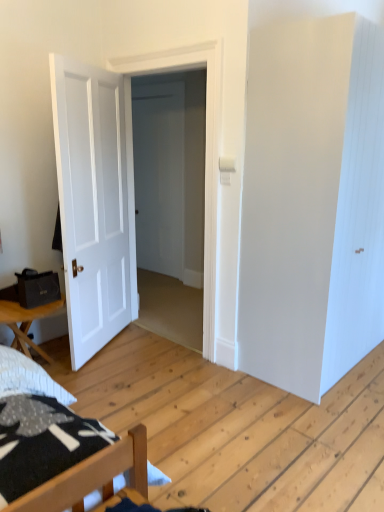
Question: From a real-world perspective, is white smooth door at center, the 2th door from the left, above or below white matte door at left, which appears as the first door when viewed from the left?

Choices:
 (A) above
 (B) below

Answer: (A)

Question: Based on their sizes in the image, would you say white smooth door at center, the first door when ordered from right to left, is bigger or smaller than white matte door at left, which appears as the first door when viewed from the left?

Choices:
 (A) small
 (B) big

Answer: (B)

Question: Estimate the real-world distances between objects in this image. Which object is closer to the wooden table at lower left?

Choices:
 (A) white matte door at left, which appears as the first door when viewed from the left
 (B) white smooth door at center, the first door when ordered from right to left

Answer: (A)

Question: Considering the real-world distances, which object is farthest from the white matte door at left, which appears as the first door when viewed from the left?

Choices:
 (A) wooden table at lower left
 (B) white smooth door at center, the first door when ordered from right to left

Answer: (A)